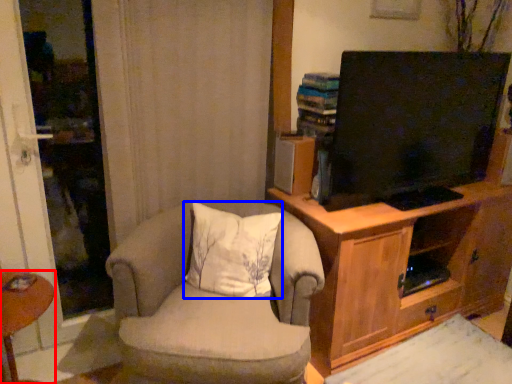
Question: Which of the following is the closest to the observer, desk (highlighted by a red box) or pillow (highlighted by a blue box)?

Choices:
 (A) desk
 (B) pillow

Answer: (A)